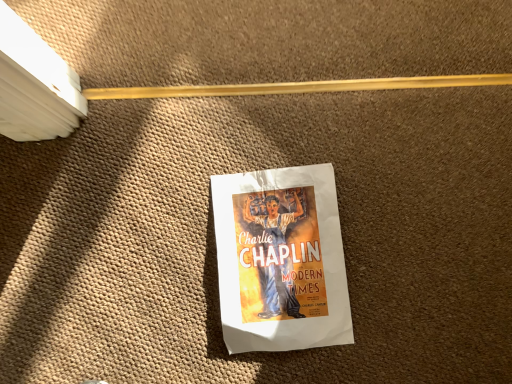
Locate an element on the screen. This screenshot has height=384, width=512. vacant area that is situated to the right of white paper poster at center is located at coordinates (417, 246).